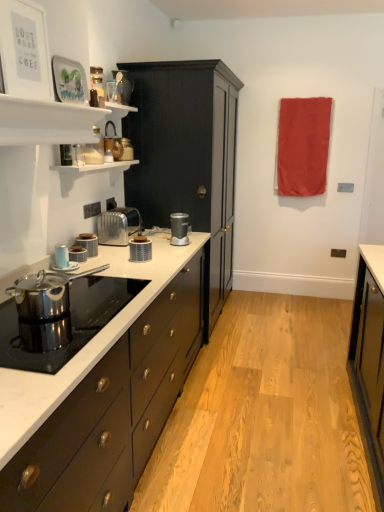
In order to face satin silver toaster at center, should I rotate leftwards or rightwards?

A 9.825 degree turn to the left will do.

Where is `matte blue cup at left, positioned as the 1th kitchen appliance in left-to-right order`? The image size is (384, 512). matte blue cup at left, positioned as the 1th kitchen appliance in left-to-right order is located at coordinates (x=61, y=256).

Where is `matte glass jar at upper center, placed as the 3th appliance when sorted from bottom to top`? The image size is (384, 512). matte glass jar at upper center, placed as the 3th appliance when sorted from bottom to top is located at coordinates (123, 86).

I want to click on white marble countertop at center, so click(x=104, y=386).

Which is in front, point (16, 106) or point (62, 258)?

Positioned in front is point (16, 106).

Which of these two, white glossy shelves at upper left or matte blue cup at left, which ranks as the fifth kitchen appliance in right-to-left order, is thinner?

matte blue cup at left, which ranks as the fifth kitchen appliance in right-to-left order, is thinner.

Is the position of white glossy shelves at upper left less distant than that of matte blue cup at left, positioned as the 1th kitchen appliance in left-to-right order?

Yes.

Does white glossy shelves at upper left have a smaller size compared to matte blue cup at left, which ranks as the 1th kitchen appliance in front-to-back order?

Incorrect, white glossy shelves at upper left is not smaller in size than matte blue cup at left, which ranks as the 1th kitchen appliance in front-to-back order.

Does point (130, 241) appear closer or farther from the camera than point (12, 114)?

Point (130, 241).

From a real-world perspective, is matte silver toaster at center, positioned as the second kitchen appliance in right-to-left order, located beneath white glossy shelves at upper left?

Yes, from a real-world perspective, matte silver toaster at center, positioned as the second kitchen appliance in right-to-left order, is beneath white glossy shelves at upper left.

Considering the sizes of objects matte silver toaster at center, the third kitchen appliance when ordered from front to back, and white glossy shelves at upper left in the image provided, who is smaller, matte silver toaster at center, the third kitchen appliance when ordered from front to back, or white glossy shelves at upper left?

matte silver toaster at center, the third kitchen appliance when ordered from front to back.

Is matte silver toaster at center, the 4th kitchen appliance viewed from the left, not close to white glossy shelves at upper left?

matte silver toaster at center, the 4th kitchen appliance viewed from the left, is near white glossy shelves at upper left, not far away.

Considering the relative positions of matte black cabinet at center and matte silver toaster at center, the third kitchen appliance when ordered from back to front, in the image provided, is matte black cabinet at center behind matte silver toaster at center, the third kitchen appliance when ordered from back to front,?

Yes, it is behind matte silver toaster at center, the third kitchen appliance when ordered from back to front.

Is matte black cabinet at center bigger than matte silver toaster at center, the third kitchen appliance when ordered from front to back?

Indeed, matte black cabinet at center has a larger size compared to matte silver toaster at center, the third kitchen appliance when ordered from front to back.

Identify the location of kitchen appliance that is the 2nd object to the left of the matte black cabinet at center, starting at the anchor. (140, 249).

Considering the positions of objects matte black cabinet at center and matte silver toaster at center, positioned as the second kitchen appliance in right-to-left order, in the image provided, who is more to the right, matte black cabinet at center or matte silver toaster at center, positioned as the second kitchen appliance in right-to-left order,?

matte black cabinet at center is more to the right.

Does matte glass jar at upper center, placed as the 3th appliance when sorted from bottom to top, have a lesser height compared to white glossy shelves at upper left?

Incorrect, the height of matte glass jar at upper center, placed as the 3th appliance when sorted from bottom to top, does not fall short of that of white glossy shelves at upper left.

From a real-world perspective, is matte glass jar at upper center, which is the 2th appliance in front-to-back order, positioned under white glossy shelves at upper left based on gravity?

No, from a real-world perspective, matte glass jar at upper center, which is the 2th appliance in front-to-back order, is not below white glossy shelves at upper left.

Visually, is matte glass jar at upper center, the 2th appliance viewed from the back, positioned to the left or to the right of white glossy shelves at upper left?

matte glass jar at upper center, the 2th appliance viewed from the back, is to the right of white glossy shelves at upper left.

From the picture: Is matte glass jar at upper center, placed as the 3th appliance when sorted from bottom to top, oriented towards white glossy shelves at upper left?

No, matte glass jar at upper center, placed as the 3th appliance when sorted from bottom to top, is not oriented towards white glossy shelves at upper left.

Is white marble countertop at center placed right next to matte black toaster at center left, acting as the 3th kitchen appliance starting from the right?

No, white marble countertop at center is not with matte black toaster at center left, acting as the 3th kitchen appliance starting from the right.

Is white marble countertop at center turned away from matte black toaster at center left, the 2th kitchen appliance positioned from the back?

No, white marble countertop at center is not facing away from matte black toaster at center left, the 2th kitchen appliance positioned from the back.

From the image's perspective, is white marble countertop at center over matte black toaster at center left, acting as the 3th kitchen appliance starting from the right?

No, from the image's perspective, white marble countertop at center is not over matte black toaster at center left, acting as the 3th kitchen appliance starting from the right.

Which object is further away from the camera, white glossy shelves at upper left or metallic copper kettle at upper center, the second appliance positioned from the top?

metallic copper kettle at upper center, the second appliance positioned from the top, is further from the camera.

Is white glossy shelves at upper left smaller than metallic copper kettle at upper center, placed as the second appliance when sorted from bottom to top?

Incorrect, white glossy shelves at upper left is not smaller in size than metallic copper kettle at upper center, placed as the second appliance when sorted from bottom to top.

From a real-world perspective, relative to metallic copper kettle at upper center, the second appliance positioned from the top, is white glossy shelves at upper left vertically above or below?

In terms of real-world spatial position, white glossy shelves at upper left is above metallic copper kettle at upper center, the second appliance positioned from the top.

Does point (40, 121) lie in front of point (124, 146)?

Yes.

Is satin silver blender at center, the 1th kitchen appliance viewed from the back, facing away from satin silver toaster at center?

satin silver blender at center, the 1th kitchen appliance viewed from the back, is not turned away from satin silver toaster at center.

Between satin silver blender at center, the 1th kitchen appliance when ordered from right to left, and satin silver toaster at center, which one is positioned in front?

satin silver toaster at center is in front.

Considering the relative positions of satin silver blender at center, the 1th kitchen appliance when ordered from right to left, and satin silver toaster at center in the image provided, is satin silver blender at center, the 1th kitchen appliance when ordered from right to left, to the right of satin silver toaster at center from the viewer's perspective?

Indeed, satin silver blender at center, the 1th kitchen appliance when ordered from right to left, is positioned on the right side of satin silver toaster at center.

From the image's perspective, is satin silver blender at center, the 1th kitchen appliance viewed from the back, positioned above or below satin silver toaster at center?

Based on their image positions, satin silver blender at center, the 1th kitchen appliance viewed from the back, is located beneath satin silver toaster at center.

Locate an element on the screen. The width and height of the screenshot is (384, 512). shelf above the matte blue cup at left, which ranks as the 1th kitchen appliance in front-to-back order (from the image's perspective) is located at coordinates (47, 122).

From the image's perspective, starting from the white glossy shelves at upper left, which kitchen appliance is the 3rd one below? Please provide its 2D coordinates.

[(140, 249)]

When comparing their distances from matte black cabinet at center, does matte black toaster at center left, which is counted as the 4th kitchen appliance, starting from the front, or metallic copper kettle at upper center, the 3th appliance in the front-to-back sequence, seem closer?

metallic copper kettle at upper center, the 3th appliance in the front-to-back sequence, lies closer to matte black cabinet at center than the other object.

Which object lies further to the anchor point red fabric towel at upper right, satin silver blender at center, acting as the fifth kitchen appliance starting from the left, or metallic silver toaster at upper left, which appears as the third appliance when viewed from the back?

The object further to red fabric towel at upper right is metallic silver toaster at upper left, which appears as the third appliance when viewed from the back.

Estimate the real-world distances between objects in this image. Which object is closer to matte glass jar at upper center, which is the 2th appliance in front-to-back order, white glossy shelves at upper left or metallic copper kettle at upper center, the 3th appliance in the front-to-back sequence?

Based on the image, metallic copper kettle at upper center, the 3th appliance in the front-to-back sequence, appears to be nearer to matte glass jar at upper center, which is the 2th appliance in front-to-back order.

From the image, which object appears to be farther from white marble countertop at center, metallic silver toaster at upper left, which appears as the third appliance when viewed from the back, or white glossy shelves at upper left?

Among the two, metallic silver toaster at upper left, which appears as the third appliance when viewed from the back, is located further to white marble countertop at center.

Estimate the real-world distances between objects in this image. Which object is closer to metallic silver toaster at upper left, marked as the third appliance in a top-to-bottom arrangement, matte glass jar at upper center, the 2th appliance viewed from the back, or metallic copper kettle at upper center, the 3th appliance in the front-to-back sequence?

Based on the image, metallic copper kettle at upper center, the 3th appliance in the front-to-back sequence, appears to be nearer to metallic silver toaster at upper left, marked as the third appliance in a top-to-bottom arrangement.

Based on their spatial positions, is matte silver toaster at left, which is counted as the 2th kitchen appliance, starting from the front, or satin silver blender at center, the 1th kitchen appliance viewed from the back, closer to matte black cabinet at center?

Based on the image, satin silver blender at center, the 1th kitchen appliance viewed from the back, appears to be nearer to matte black cabinet at center.

From the image, which object appears to be nearer to satin silver toaster at center, metallic silver toaster at upper left, which appears as the third appliance when viewed from the back, or white glossy shelves at upper left?

metallic silver toaster at upper left, which appears as the third appliance when viewed from the back.

Looking at the image, which one is located closer to matte glass jar at upper center, which is the 2th appliance in front-to-back order, white marble countertop at center or matte black toaster at center left, acting as the 3th kitchen appliance starting from the right?

Among the two, matte black toaster at center left, acting as the 3th kitchen appliance starting from the right, is located nearer to matte glass jar at upper center, which is the 2th appliance in front-to-back order.

The image size is (384, 512). What are the coordinates of `cabinetry between matte glass jar at upper center, the 2th appliance viewed from the back, and matte silver toaster at left, which is counted as the 2th kitchen appliance, starting from the front, in the up-down direction` in the screenshot? It's located at (187, 157).

Where is `toaster between metallic copper kettle at upper center, the 3th appliance in the front-to-back sequence, and matte blue cup at left, which is counted as the 5th kitchen appliance, starting from the back, vertically`? This screenshot has width=384, height=512. toaster between metallic copper kettle at upper center, the 3th appliance in the front-to-back sequence, and matte blue cup at left, which is counted as the 5th kitchen appliance, starting from the back, vertically is located at coordinates (118, 226).

This screenshot has height=512, width=384. Identify the location of cabinetry located between metallic copper kettle at upper center, the second appliance positioned from the top, and red fabric towel at upper right in the left-right direction. (187, 157).

Locate an element on the screen. This screenshot has height=512, width=384. toaster that lies between matte glass jar at upper center, placed as the first appliance when sorted from top to bottom, and satin silver blender at center, the 1th kitchen appliance when ordered from right to left, from top to bottom is located at coordinates pyautogui.click(x=118, y=226).